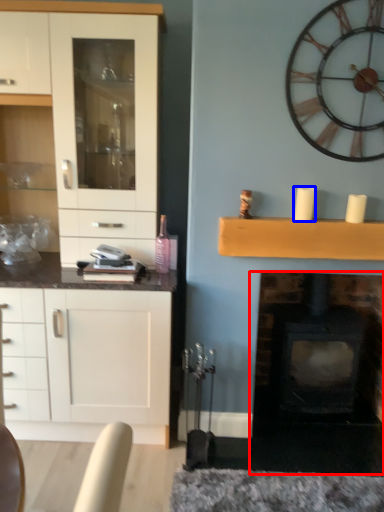
Question: Which of the following is the farthest to the observer, fireplace (highlighted by a red box) or candle (highlighted by a blue box)?

Choices:
 (A) fireplace
 (B) candle

Answer: (A)